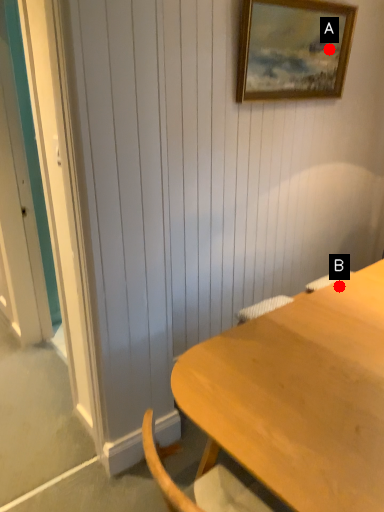
Question: Two points are circled on the image, labeled by A and B beside each circle. Among these points, which one is nearest to the camera?

Choices:
 (A) A is closer
 (B) B is closer

Answer: (B)